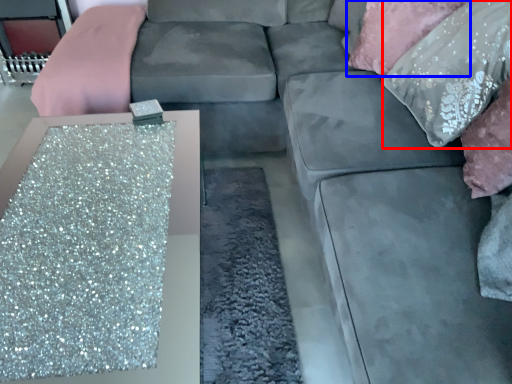
Question: Which object is closer to the camera taking this photo, pillow (highlighted by a red box) or pillow (highlighted by a blue box)?

Choices:
 (A) pillow
 (B) pillow

Answer: (A)